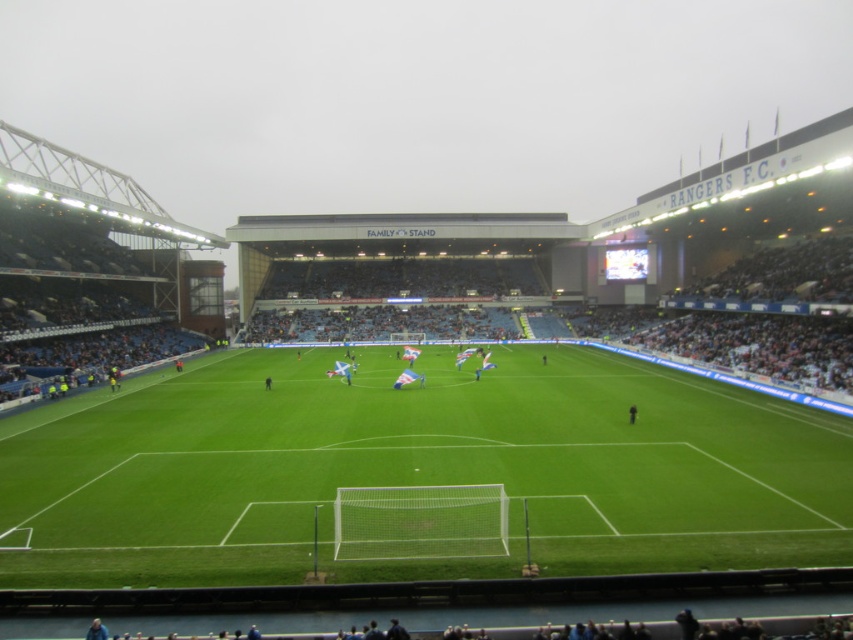
Who is lower down, green grass football field at center or black fabric person at center?

black fabric person at center is below.

Describe the element at coordinates (419, 468) in the screenshot. I see `green grass football field at center` at that location.

Find the location of a particular element. Image resolution: width=853 pixels, height=640 pixels. green grass football field at center is located at coordinates (419, 468).